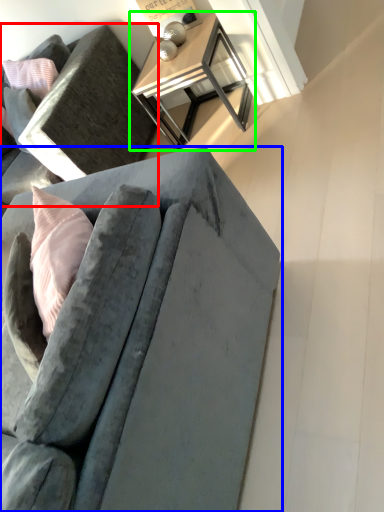
Question: Based on their relative distances, which object is farther from studio couch (highlighted by a red box)? Choose from studio couch (highlighted by a blue box) and table (highlighted by a green box).

Choices:
 (A) studio couch
 (B) table

Answer: (A)